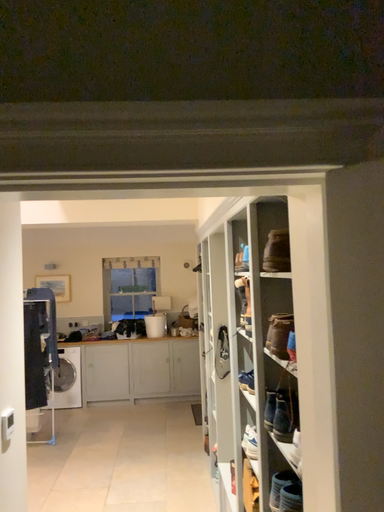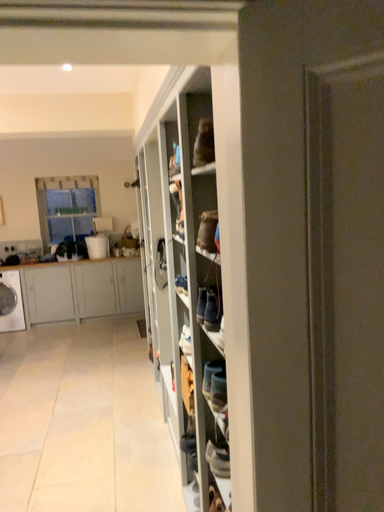
Question: How did the camera likely rotate when shooting the video?

Choices:
 (A) rotated right
 (B) rotated left

Answer: (A)